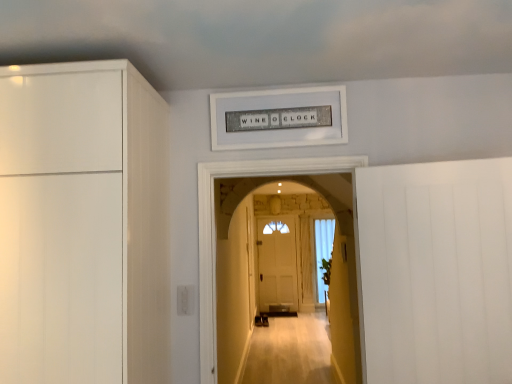
Question: Does white matte door at right have a lesser height compared to smooth beige carpet at center?

Choices:
 (A) no
 (B) yes

Answer: (B)

Question: Would you say white matte door at right contains smooth beige carpet at center?

Choices:
 (A) no
 (B) yes

Answer: (A)

Question: Is white matte door at right further to camera compared to smooth beige carpet at center?

Choices:
 (A) yes
 (B) no

Answer: (B)

Question: Considering the relative sizes of white matte door at right and smooth beige carpet at center in the image provided, is white matte door at right thinner than smooth beige carpet at center?

Choices:
 (A) yes
 (B) no

Answer: (A)

Question: From a real-world perspective, is white matte door at right over smooth beige carpet at center?

Choices:
 (A) no
 (B) yes

Answer: (A)

Question: Is white matte door at right not close to smooth beige carpet at center?

Choices:
 (A) no
 (B) yes

Answer: (A)

Question: From a real-world perspective, is white sheer curtain at center positioned under smooth beige carpet at center based on gravity?

Choices:
 (A) yes
 (B) no

Answer: (A)

Question: Does white sheer curtain at center come behind smooth beige carpet at center?

Choices:
 (A) no
 (B) yes

Answer: (B)

Question: Is white sheer curtain at center to the right of smooth beige carpet at center from the viewer's perspective?

Choices:
 (A) no
 (B) yes

Answer: (B)

Question: Can you confirm if white sheer curtain at center is taller than smooth beige carpet at center?

Choices:
 (A) no
 (B) yes

Answer: (B)

Question: Considering the relative sizes of white sheer curtain at center and smooth beige carpet at center in the image provided, is white sheer curtain at center wider than smooth beige carpet at center?

Choices:
 (A) yes
 (B) no

Answer: (B)

Question: Would you say white sheer curtain at center is a long distance from smooth beige carpet at center?

Choices:
 (A) no
 (B) yes

Answer: (B)

Question: Is smooth beige carpet at center smaller than white sheer curtain at center?

Choices:
 (A) yes
 (B) no

Answer: (B)